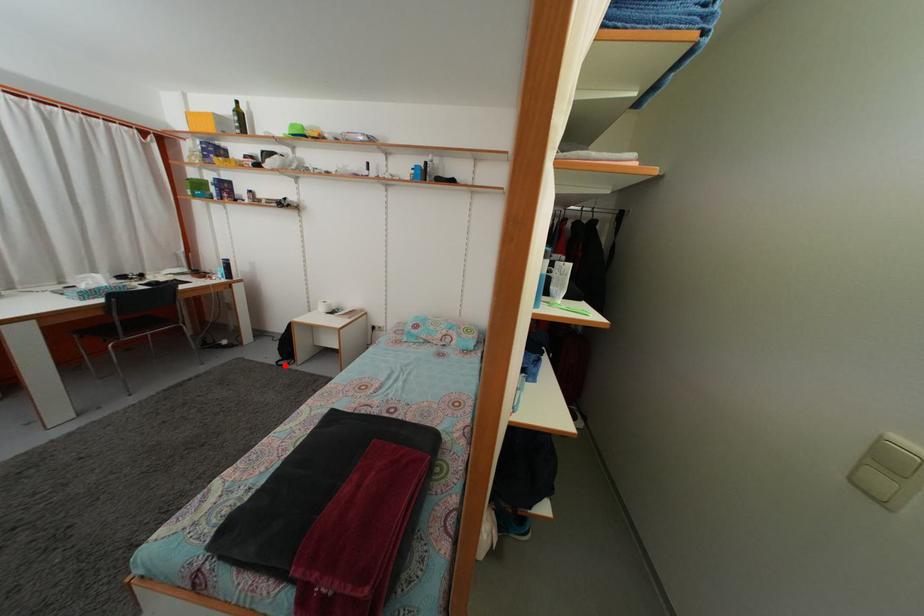
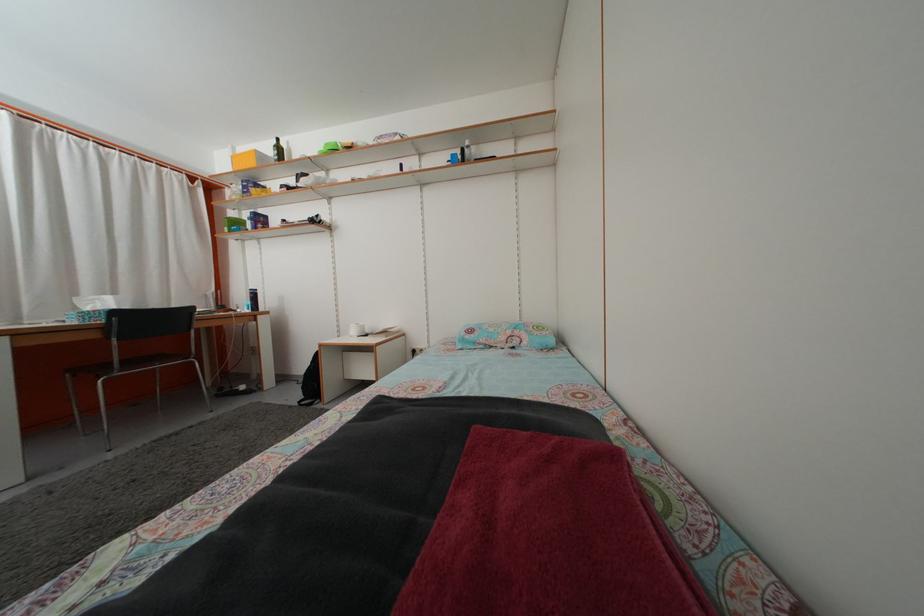
Question: I am providing you with two images of the same scene from different viewpoints. A red point is marked on the first image. Is the red point's position out of view in image 2?

Choices:
 (A) Yes
 (B) No

Answer: (B)